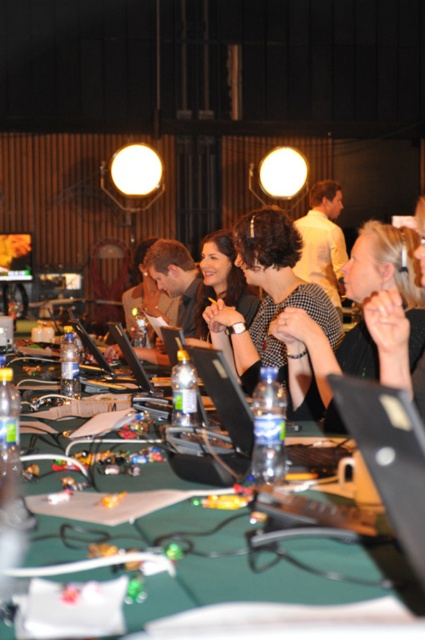
Question: Can you confirm if green fabric table at center is positioned to the right of matte black laptop at center?

Choices:
 (A) no
 (B) yes

Answer: (A)

Question: Which is nearer to the green fabric table at center?

Choices:
 (A) black textured shirt at center
 (B) matte black shirt at center

Answer: (A)

Question: Which point is closer to the camera?

Choices:
 (A) (422, 349)
 (B) (127, 358)
 (C) (257, 344)

Answer: (A)

Question: Which of the following is the farthest from the observer?

Choices:
 (A) (198, 349)
 (B) (118, 333)

Answer: (B)

Question: Can you confirm if black textured shirt at center is wider than black glossy laptop at center?

Choices:
 (A) no
 (B) yes

Answer: (B)

Question: Does green fabric table at center have a larger size compared to matte black shirt at center?

Choices:
 (A) yes
 (B) no

Answer: (B)